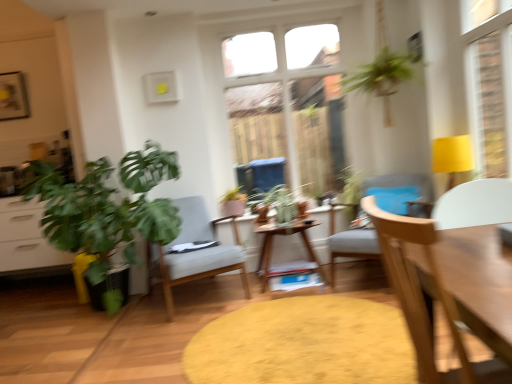
Question: Is green leafy plant at left, which ranks as the 1th houseplant in front-to-back order, positioned behind light gray fabric chair at center, marked as the 1th chair in a back-to-front arrangement?

Choices:
 (A) yes
 (B) no

Answer: (B)

Question: Would you say light gray fabric chair at center, which appears as the third chair when viewed from the right, is part of green leafy plant at left, the second houseplant positioned from the back,'s contents?

Choices:
 (A) yes
 (B) no

Answer: (A)

Question: Can you confirm if green leafy plant at left, which ranks as the 1th houseplant in front-to-back order, is smaller than light gray fabric chair at center, marked as the 1th chair in a back-to-front arrangement?

Choices:
 (A) yes
 (B) no

Answer: (B)

Question: Considering the relative sizes of green leafy plant at left, the second houseplant positioned from the back, and light gray fabric chair at center, which appears as the 3th chair when viewed from the front, in the image provided, is green leafy plant at left, the second houseplant positioned from the back, shorter than light gray fabric chair at center, which appears as the 3th chair when viewed from the front,?

Choices:
 (A) no
 (B) yes

Answer: (A)

Question: Can you confirm if green leafy plant at left, the 1th houseplant when ordered from left to right, is wider than light gray fabric chair at center, which appears as the third chair when viewed from the right?

Choices:
 (A) yes
 (B) no

Answer: (A)

Question: Could you tell me if green leafy plant at left, the 1th houseplant when ordered from left to right, is turned towards light gray fabric chair at center, the 1th chair positioned from the left?

Choices:
 (A) no
 (B) yes

Answer: (A)

Question: Is green leafy plant at left, positioned as the 2th houseplant in right-to-left order, completely or partially inside matte pink pot at center, which is the 2th houseplant from front to back?

Choices:
 (A) yes
 (B) no

Answer: (B)

Question: Is matte pink pot at center, which is the 2th houseplant from front to back, looking in the opposite direction of green leafy plant at left, positioned as the 2th houseplant in right-to-left order?

Choices:
 (A) yes
 (B) no

Answer: (B)

Question: Considering the relative positions of matte pink pot at center, the second houseplant positioned from the left, and green leafy plant at left, the 1th houseplant when ordered from left to right, in the image provided, is matte pink pot at center, the second houseplant positioned from the left, behind green leafy plant at left, the 1th houseplant when ordered from left to right,?

Choices:
 (A) yes
 (B) no

Answer: (A)

Question: Considering the relative positions of matte pink pot at center, which is the first houseplant from right to left, and green leafy plant at left, the second houseplant positioned from the back, in the image provided, is matte pink pot at center, which is the first houseplant from right to left, to the right of green leafy plant at left, the second houseplant positioned from the back, from the viewer's perspective?

Choices:
 (A) no
 (B) yes

Answer: (B)

Question: Is matte pink pot at center, which is the 2th houseplant from front to back, located outside green leafy plant at left, positioned as the 2th houseplant in right-to-left order?

Choices:
 (A) no
 (B) yes

Answer: (B)

Question: Considering the relative sizes of matte pink pot at center, the second houseplant positioned from the left, and green leafy plant at left, which ranks as the 1th houseplant in front-to-back order, in the image provided, is matte pink pot at center, the second houseplant positioned from the left, shorter than green leafy plant at left, which ranks as the 1th houseplant in front-to-back order,?

Choices:
 (A) no
 (B) yes

Answer: (B)

Question: Does light gray fabric chair at center, acting as the 1th chair starting from the right, have a greater height compared to green leafy plant at left, the 1th houseplant when ordered from left to right?

Choices:
 (A) yes
 (B) no

Answer: (B)